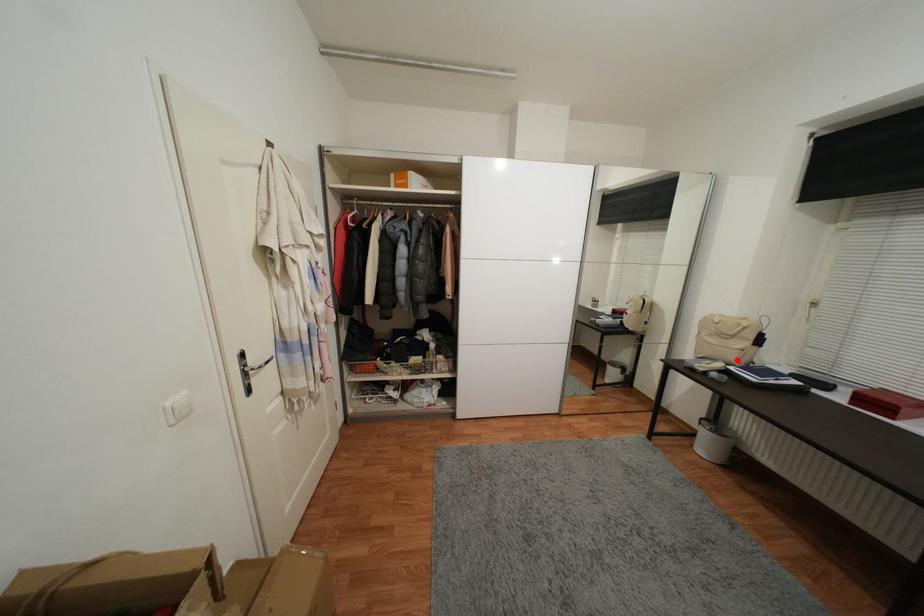
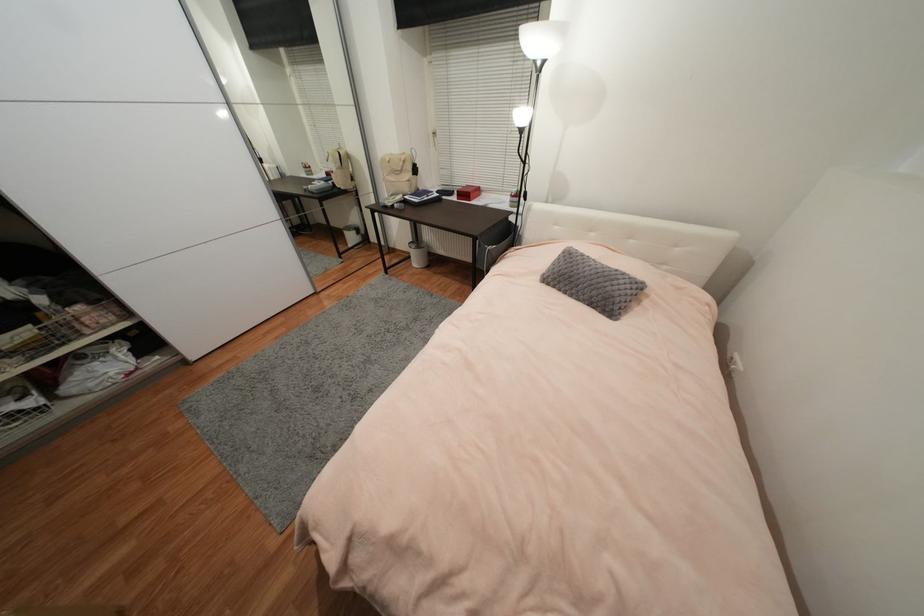
Question: A red point is marked in image1. In image2, is the corresponding 3D point closer to the camera or farther? Reply with the corresponding letter.

Choices:
 (A) The corresponding 3D point is closer.
 (B) The corresponding 3D point is farther.

Answer: (A)